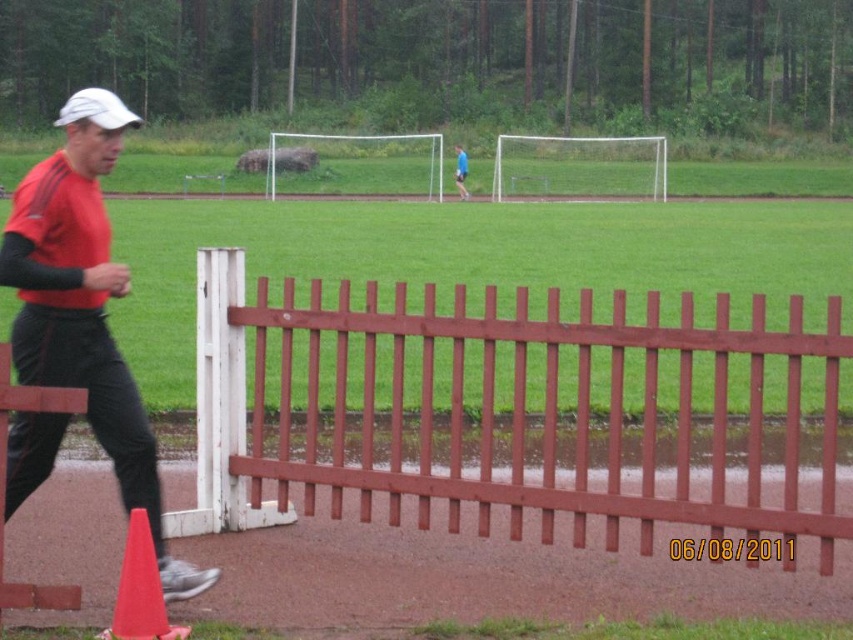
Question: Which is farther from the blue fabric shirt at center?

Choices:
 (A) orange matte traffic cone at lower left
 (B) brown wooden fence at center
 (C) matte red shirt at left

Answer: (A)

Question: Is orange matte traffic cone at lower left above blue fabric shirt at center?

Choices:
 (A) no
 (B) yes

Answer: (A)

Question: From the image, what is the correct spatial relationship of brown wooden fence at center in relation to matte red shirt at left?

Choices:
 (A) above
 (B) below

Answer: (B)

Question: Can you confirm if matte red shirt at left is smaller than blue fabric shirt at center?

Choices:
 (A) no
 (B) yes

Answer: (A)

Question: Which point appears farthest from the camera in this image?

Choices:
 (A) (793, 528)
 (B) (138, 604)

Answer: (A)

Question: Which point is farther from the camera taking this photo?

Choices:
 (A) (798, 428)
 (B) (462, 189)
 (C) (158, 589)
 (D) (97, 404)

Answer: (B)